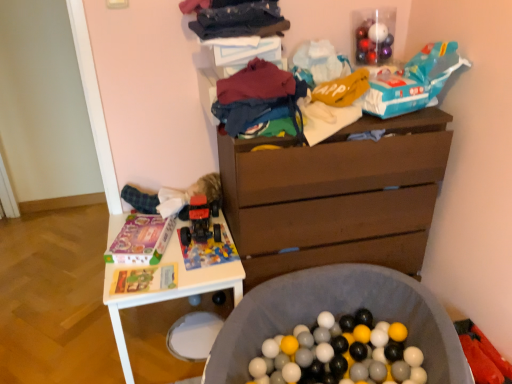
Where is `free space above brick-patterned plastic toy car at center, which ranks as the first toy in bottom-to-top order (from a real-world perspective)`? This screenshot has height=384, width=512. free space above brick-patterned plastic toy car at center, which ranks as the first toy in bottom-to-top order (from a real-world perspective) is located at coordinates (203, 242).